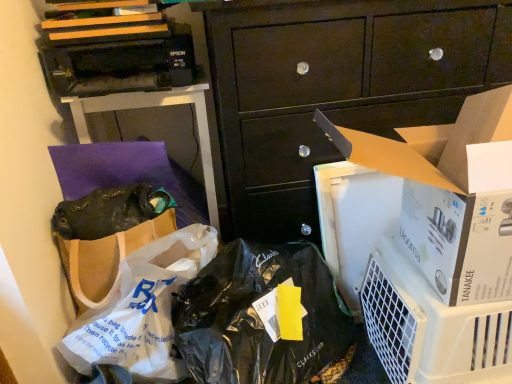
Question: Considering the relative positions of brown paper bag at upper left and white plastic air purifier at lower right in the image provided, is brown paper bag at upper left to the right of white plastic air purifier at lower right from the viewer's perspective?

Choices:
 (A) yes
 (B) no

Answer: (B)

Question: From a real-world perspective, is brown paper bag at upper left beneath white plastic air purifier at lower right?

Choices:
 (A) no
 (B) yes

Answer: (A)

Question: From the image's perspective, is brown paper bag at upper left located beneath white plastic air purifier at lower right?

Choices:
 (A) yes
 (B) no

Answer: (B)

Question: Is brown paper bag at upper left to the left of white plastic air purifier at lower right from the viewer's perspective?

Choices:
 (A) no
 (B) yes

Answer: (B)

Question: Are brown paper bag at upper left and white plastic air purifier at lower right far apart?

Choices:
 (A) no
 (B) yes

Answer: (A)

Question: Considering the positions of point (371, 319) and point (129, 336), is point (371, 319) closer or farther from the camera than point (129, 336)?

Choices:
 (A) closer
 (B) farther

Answer: (B)

Question: From a real-world perspective, relative to white plastic bag at lower left, is white plastic air purifier at lower right vertically above or below?

Choices:
 (A) above
 (B) below

Answer: (B)

Question: Based on their positions, is white plastic air purifier at lower right located to the left or right of white plastic bag at lower left?

Choices:
 (A) left
 (B) right

Answer: (B)

Question: Is white plastic air purifier at lower right in front of or behind white plastic bag at lower left in the image?

Choices:
 (A) front
 (B) behind

Answer: (B)

Question: In terms of size, does matte black handbag at center-left appear bigger or smaller than dark wood cabinet at center?

Choices:
 (A) small
 (B) big

Answer: (A)

Question: Is matte black handbag at center-left taller or shorter than dark wood cabinet at center?

Choices:
 (A) short
 (B) tall

Answer: (A)

Question: From the image's perspective, is matte black handbag at center-left positioned above or below dark wood cabinet at center?

Choices:
 (A) below
 (B) above

Answer: (A)

Question: Is matte black handbag at center-left to the left or to the right of dark wood cabinet at center in the image?

Choices:
 (A) left
 (B) right

Answer: (A)

Question: Is white plastic bag at lower left taller or shorter than white plastic air purifier at lower right?

Choices:
 (A) tall
 (B) short

Answer: (B)

Question: Is white plastic bag at lower left spatially inside white plastic air purifier at lower right, or outside of it?

Choices:
 (A) inside
 (B) outside

Answer: (B)